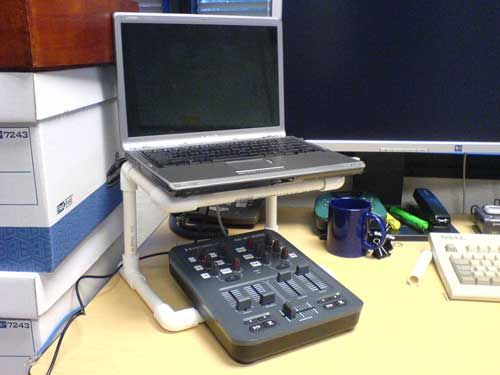
In order to click on control panel in this screenshot , I will do `click(263, 278)`.